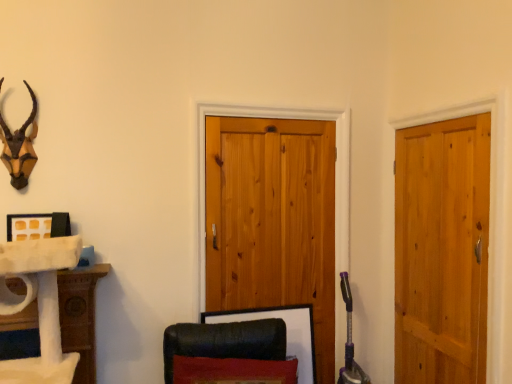
Describe the element at coordinates (272, 221) in the screenshot. I see `natural wood barn door at center` at that location.

The width and height of the screenshot is (512, 384). What are the coordinates of `wooden picture frame at lower center` in the screenshot? It's located at (286, 332).

Identify the location of natural wood barn door at center. (272, 221).

Can you confirm if wooden picture frame at lower center is bigger than natural wood barn door at center?

No, wooden picture frame at lower center is not bigger than natural wood barn door at center.

Looking at this image, would you say wooden picture frame at lower center is inside or outside natural wood barn door at center?

wooden picture frame at lower center is located inside natural wood barn door at center.

From a real-world perspective, who is located higher, wooden picture frame at lower center or natural wood barn door at center?

From a 3D spatial view, natural wood barn door at center is above.

Considering the sizes of light brown wooden door at right and wooden picture frame at lower center in the image, is light brown wooden door at right wider or thinner than wooden picture frame at lower center?

In the image, light brown wooden door at right appears to be more narrow than wooden picture frame at lower center.

Is light brown wooden door at right looking in the opposite direction of wooden picture frame at lower center?

light brown wooden door at right does not have its back to wooden picture frame at lower center.

Locate an element on the screen. This screenshot has width=512, height=384. door on the right of wooden picture frame at lower center is located at coordinates (442, 250).

From the image's perspective, who appears lower, light brown wooden door at right or wooden picture frame at lower center?

wooden picture frame at lower center appears lower in the image.

From a real-world perspective, is natural wood barn door at center above or below light brown wooden door at right?

natural wood barn door at center is situated higher than light brown wooden door at right in the real world.

Could you tell me if natural wood barn door at center is facing light brown wooden door at right?

No, natural wood barn door at center is not facing towards light brown wooden door at right.

Considering their positions, is natural wood barn door at center located in front of or behind light brown wooden door at right?

Clearly, natural wood barn door at center is behind light brown wooden door at right.

From the image's perspective, is natural wood barn door at center under light brown wooden door at right?

No, from the image's perspective, natural wood barn door at center is not beneath light brown wooden door at right.

Does natural wood barn door at center turn towards wooden picture frame at lower center?

Yes, natural wood barn door at center is turned towards wooden picture frame at lower center.

In the image, is natural wood barn door at center positioned in front of or behind wooden picture frame at lower center?

natural wood barn door at center is behind wooden picture frame at lower center.

Where is `picture frame on the left of natural wood barn door at center`? picture frame on the left of natural wood barn door at center is located at coordinates (286, 332).

Is point (300, 219) less distant than point (313, 336)?

Yes, it is.

Is light brown wooden door at right spatially inside natural wood barn door at center, or outside of it?

light brown wooden door at right exists outside the volume of natural wood barn door at center.

Considering the sizes of objects light brown wooden door at right and natural wood barn door at center in the image provided, who is thinner, light brown wooden door at right or natural wood barn door at center?

Thinner between the two is light brown wooden door at right.

Is light brown wooden door at right facing away from natural wood barn door at center?

No, light brown wooden door at right is not facing away from natural wood barn door at center.

From a real-world perspective, is light brown wooden door at right physically located above or below natural wood barn door at center?

light brown wooden door at right is below natural wood barn door at center.

Between wooden picture frame at lower center and light brown wooden door at right, which one has smaller width?

light brown wooden door at right.

From a real-world perspective, does wooden picture frame at lower center sit lower than light brown wooden door at right?

Indeed, from a real-world perspective, wooden picture frame at lower center is positioned beneath light brown wooden door at right.

From the image's perspective, between wooden picture frame at lower center and light brown wooden door at right, who is located below?

wooden picture frame at lower center, from the image's perspective.

Would you say light brown wooden door at right is part of wooden picture frame at lower center's contents?

No, light brown wooden door at right is located outside of wooden picture frame at lower center.

You are a GUI agent. You are given a task and a screenshot of the screen. Output one action in this format:
    pyautogui.click(x=<x>, y=<y>)
    Task: Click on the barn door that appears behind the wooden picture frame at lower center
    Image resolution: width=512 pixels, height=384 pixels.
    Given the screenshot: What is the action you would take?
    pyautogui.click(x=272, y=221)

This screenshot has height=384, width=512. I want to click on door in front of the wooden picture frame at lower center, so click(x=442, y=250).

From the image, which object appears to be farther from wooden picture frame at lower center, light brown wooden door at right or natural wood barn door at center?

light brown wooden door at right is positioned further to the anchor wooden picture frame at lower center.

From the image, which object appears to be nearer to wooden picture frame at lower center, natural wood barn door at center or light brown wooden door at right?

Based on the image, natural wood barn door at center appears to be nearer to wooden picture frame at lower center.

Based on the photo, estimate the real-world distances between objects in this image. Which object is further from natural wood barn door at center, wooden picture frame at lower center or light brown wooden door at right?

light brown wooden door at right lies further to natural wood barn door at center than the other object.

From the image, which object appears to be nearer to light brown wooden door at right, wooden picture frame at lower center or natural wood barn door at center?

Based on the image, natural wood barn door at center appears to be nearer to light brown wooden door at right.

Estimate the real-world distances between objects in this image. Which object is closer to natural wood barn door at center, light brown wooden door at right or wooden picture frame at lower center?

Among the two, wooden picture frame at lower center is located nearer to natural wood barn door at center.

Looking at the image, which one is located closer to light brown wooden door at right, natural wood barn door at center or wooden picture frame at lower center?

natural wood barn door at center is closer to light brown wooden door at right.

Identify the location of barn door located between wooden picture frame at lower center and light brown wooden door at right in the left-right direction. The image size is (512, 384). (272, 221).